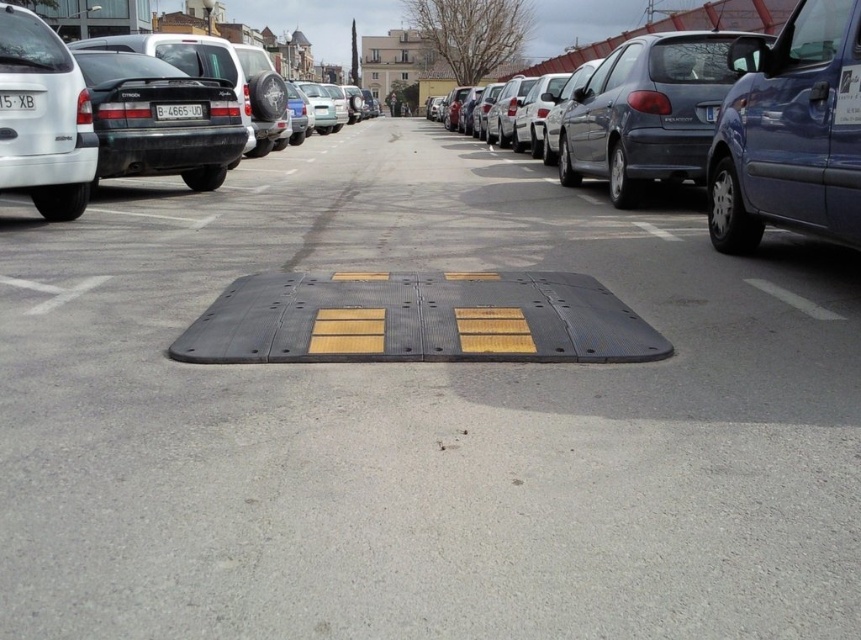
From the picture: You are a driver trying to park your car in the parking lot. You notice two license plates in the scene. Which license plate, the yellow matte license plate at center or the white plastic license plate at right, is taller?

The yellow matte license plate at center has a greater height compared to the white plastic license plate at right, so the yellow matte license plate at center is taller.

You are a delivery driver who needs to park your van in this parking lot. Your van has a large yellow matte license plate at center. You see another vehicle with a white plastic license plate at right. Which license plate is bigger?

The yellow matte license plate at center is larger in size than the white plastic license plate at right.